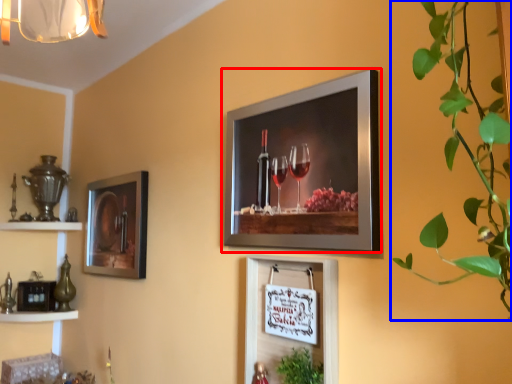
Question: Which of the following is the farthest to the observer, picture frame (highlighted by a red box) or houseplant (highlighted by a blue box)?

Choices:
 (A) picture frame
 (B) houseplant

Answer: (A)